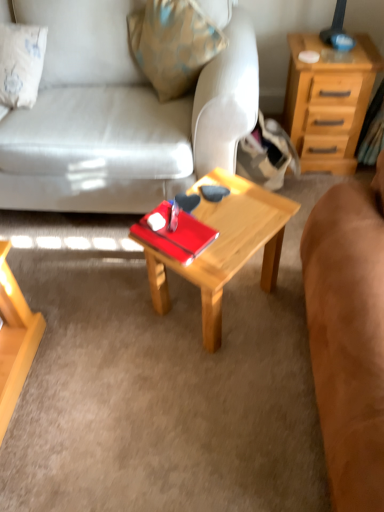
At what (x,y) coordinates should I click in order to perform the action: click on free space above wooden coffee table at center (from a real-world perspective). Please return your answer as a coordinate pair (x, y). The width and height of the screenshot is (384, 512). Looking at the image, I should click on (235, 217).